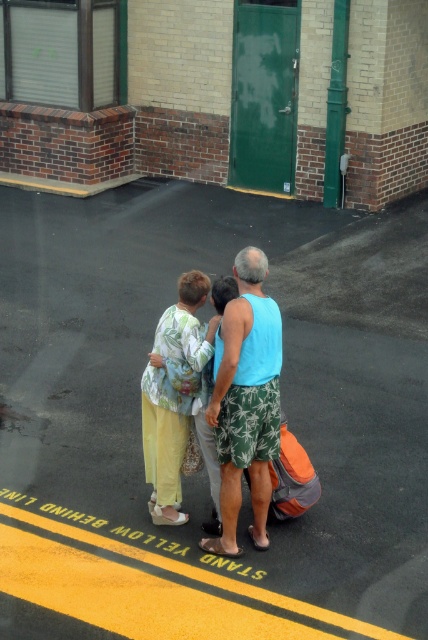
Which of these two, blue fabric tank top at center or floral fabric blouse at center, stands taller?

blue fabric tank top at center is taller.

The width and height of the screenshot is (428, 640). What do you see at coordinates (246, 401) in the screenshot? I see `blue fabric tank top at center` at bounding box center [246, 401].

In order to click on blue fabric tank top at center in this screenshot , I will do `click(246, 401)`.

Find the location of `black asphalt at center`. black asphalt at center is located at coordinates (204, 472).

Can you confirm if black asphalt at center is wider than floral fabric blouse at center?

Yes.

The image size is (428, 640). What do you see at coordinates (204, 472) in the screenshot?
I see `black asphalt at center` at bounding box center [204, 472].

The height and width of the screenshot is (640, 428). In order to click on black asphalt at center in this screenshot , I will do `click(204, 472)`.

What are the coordinates of `black asphalt at center` in the screenshot? It's located at (204, 472).

How much distance is there between black asphalt at center and blue fabric tank top at center?

The distance of black asphalt at center from blue fabric tank top at center is 3.19 meters.

Does point (296, 378) come in front of point (267, 406)?

No, it is behind (267, 406).

The width and height of the screenshot is (428, 640). What are the coordinates of `black asphalt at center` in the screenshot? It's located at (204, 472).